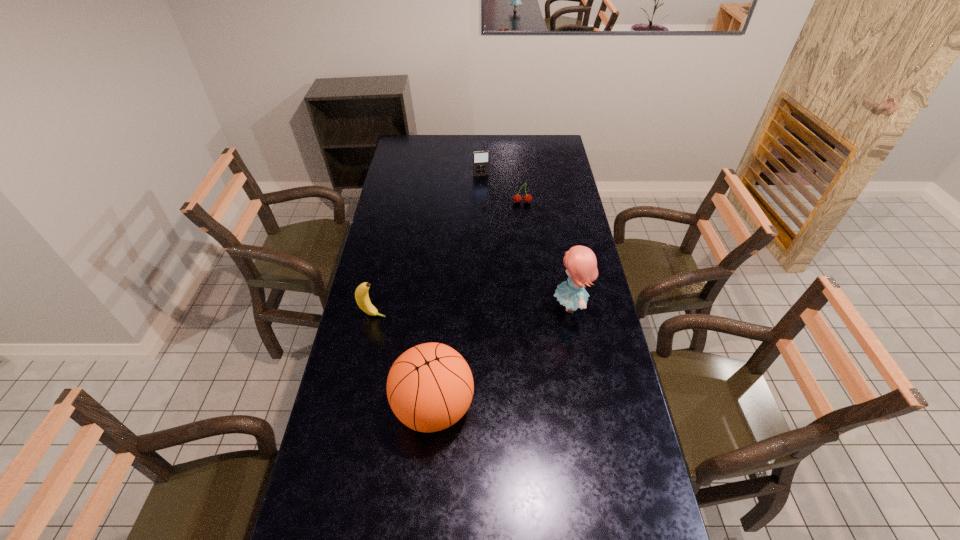
Where is `blank area located 0.120m on the front-facing side of the rightmost object`? blank area located 0.120m on the front-facing side of the rightmost object is located at coordinates (519, 306).

The image size is (960, 540). Find the location of `vacant region located 0.110m on the front-facing side of the rightmost object`. vacant region located 0.110m on the front-facing side of the rightmost object is located at coordinates (521, 306).

Locate an element on the screen. Image resolution: width=960 pixels, height=540 pixels. vacant area located 0.070m on the front-facing side of the rightmost object is located at coordinates (533, 306).

Where is `free space located 0.110m on the surface of the shortest object`? The image size is (960, 540). free space located 0.110m on the surface of the shortest object is located at coordinates (522, 220).

Identify the location of free space located 0.160m on the surface of the shortest object. (522, 227).

Identify the location of free region located 0.220m on the surface of the shortest object. The height and width of the screenshot is (540, 960). coord(522,236).

Locate an element on the screen. This screenshot has width=960, height=540. free space located from the stem of the leftmost object is located at coordinates (399, 318).

Image resolution: width=960 pixels, height=540 pixels. I want to click on vacant space located 0.260m from the stem of the leftmost object, so click(455, 328).

This screenshot has width=960, height=540. Find the location of `free space located from the stem of the leftmost object`. free space located from the stem of the leftmost object is located at coordinates (437, 325).

This screenshot has height=540, width=960. What are the coordinates of `vacant position located 0.150m on the front-facing side of the second shortest object` in the screenshot? It's located at (487, 194).